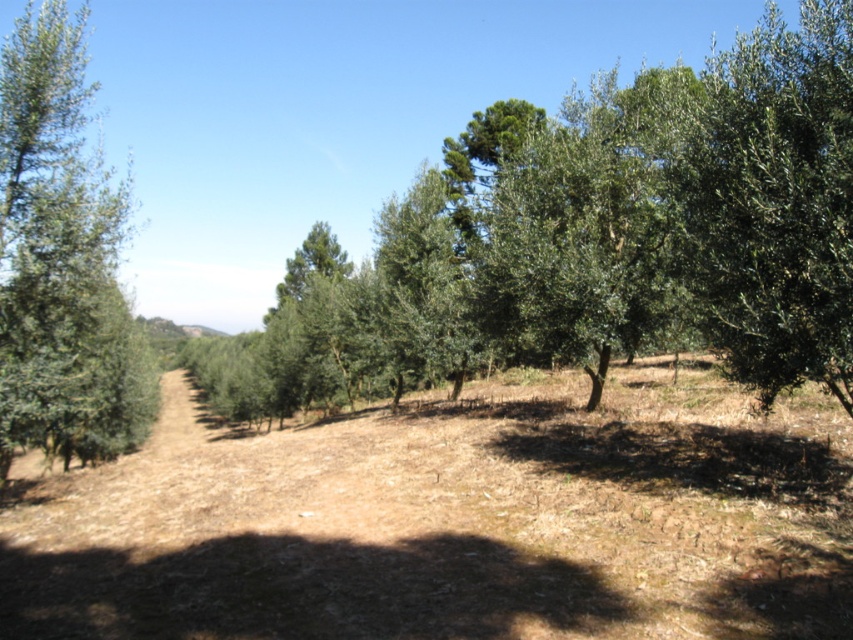
This screenshot has width=853, height=640. What do you see at coordinates (596, 240) in the screenshot? I see `green leafy tree at center` at bounding box center [596, 240].

From the picture: Who is lower down, green leafy tree at center or green leafy tree at right?

green leafy tree at center

Is point (751, 136) positioned in front of point (830, 12)?

That is True.

The image size is (853, 640). I want to click on green leafy tree at center, so click(596, 240).

Who is shorter, green leafy tree at center or green leafy tree at left?

green leafy tree at center

Where is `green leafy tree at center`? green leafy tree at center is located at coordinates (596, 240).

Find the location of a particular element. The image size is (853, 640). green leafy tree at center is located at coordinates (596, 240).

Is green leafy tree at right to the right of green leafy tree at left from the viewer's perspective?

Indeed, green leafy tree at right is positioned on the right side of green leafy tree at left.

Is point (791, 323) in front of point (102, 234)?

Yes, it is.

Locate an element on the screen. The image size is (853, 640). green leafy tree at right is located at coordinates (775, 202).